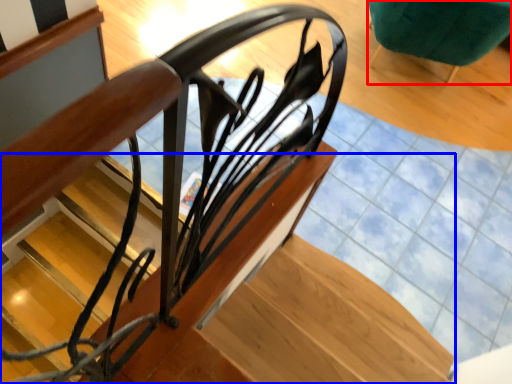
Question: Which object appears closest to the camera in this image, furniture (highlighted by a red box) or stairs (highlighted by a blue box)?

Choices:
 (A) furniture
 (B) stairs

Answer: (B)